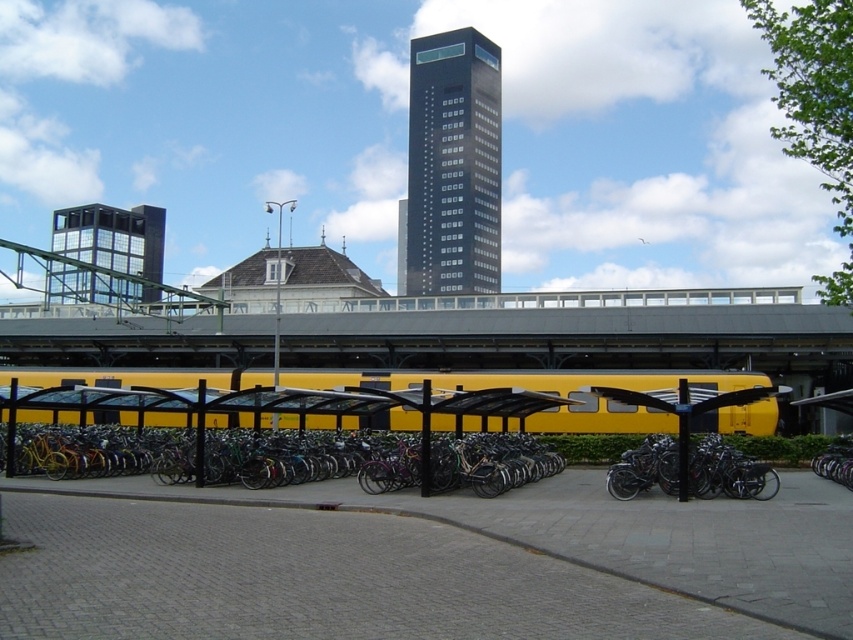
You are standing at the railway station and want to take a photo of the glassy reflective tower at upper left without the gray concrete pavement at lower center blocking the view. Is it possible to do so by adjusting your position?

Yes, since the gray concrete pavement at lower center is below the glassy reflective tower at upper left, you can position yourself lower or move to a higher vantage point to avoid the pavement blocking the tower.